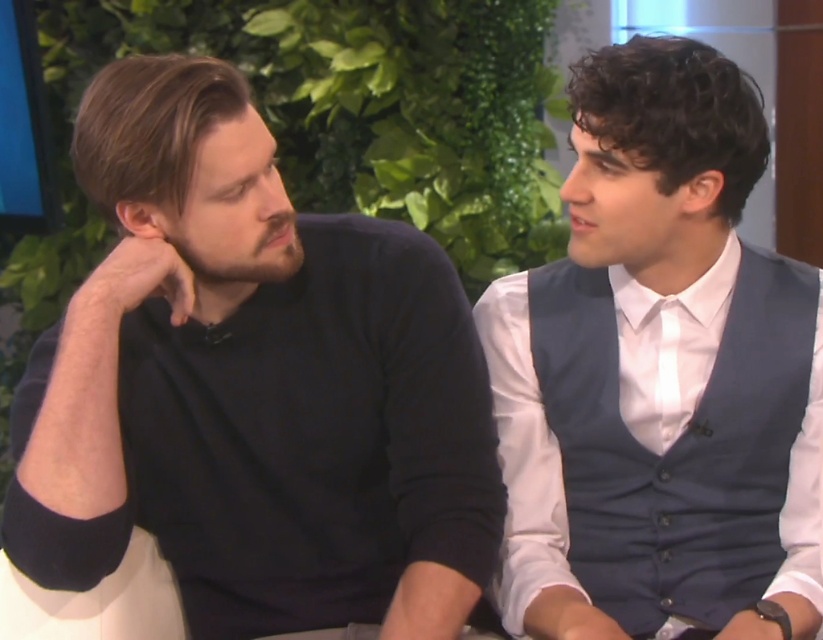
Question: Is matte black sweater at left thinner than white satin tie at center?

Choices:
 (A) yes
 (B) no

Answer: (B)

Question: In this image, where is white shirt with navy blue vest at right located relative to white satin tie at center?

Choices:
 (A) above
 (B) below

Answer: (A)

Question: Which of the following is the closest to the observer?

Choices:
 (A) (663, 396)
 (B) (147, 116)

Answer: (B)

Question: Among these points, which one is farthest from the camera?

Choices:
 (A) (291, 355)
 (B) (732, 209)

Answer: (B)

Question: Which object is positioned farthest from the matte black sweater at left?

Choices:
 (A) white satin tie at center
 (B) white shirt with navy blue vest at right

Answer: (A)

Question: Does matte black sweater at left have a larger size compared to white satin tie at center?

Choices:
 (A) no
 (B) yes

Answer: (B)